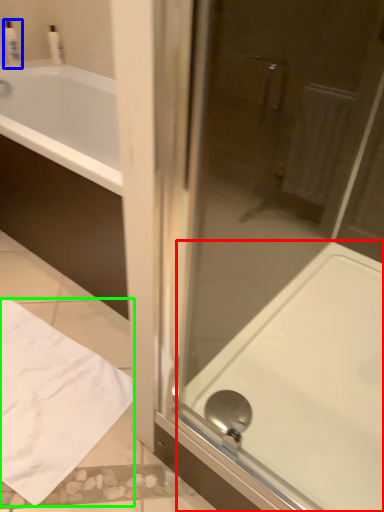
Question: Which is nearer to the bath (highlighted by a red box)? toiletry (highlighted by a blue box) or sheet (highlighted by a green box).

Choices:
 (A) toiletry
 (B) sheet

Answer: (B)